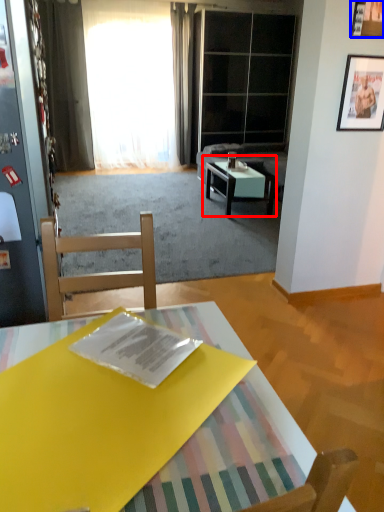
Question: Which object is closer to the camera taking this photo, coffee table (highlighted by a red box) or picture frame (highlighted by a blue box)?

Choices:
 (A) coffee table
 (B) picture frame

Answer: (B)